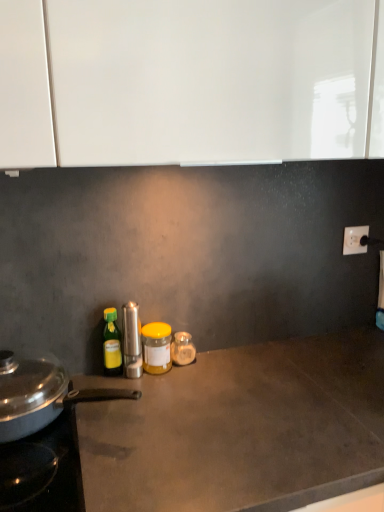
Find the location of a particular element. Image resolution: width=384 pixels, height=512 pixels. vacant space that is to the left of satin silver pepper mill at center, the 1th kitchen appliance positioned from the right is located at coordinates (95, 385).